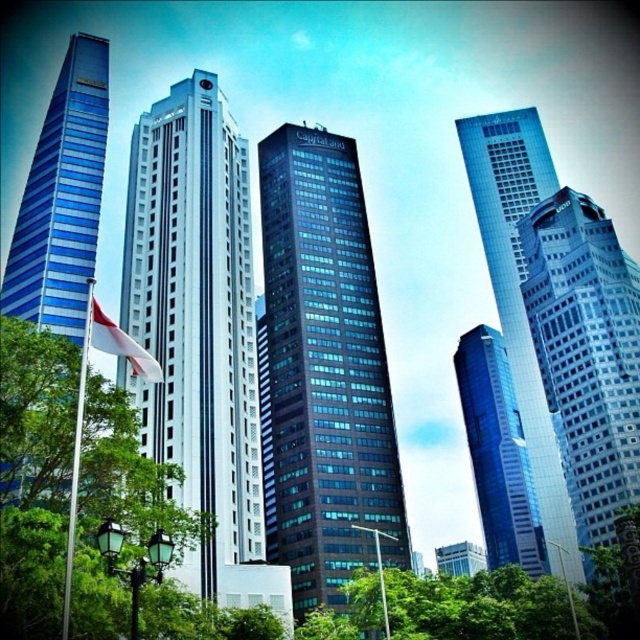
Between point (86, 380) and point (381, 586), which one is positioned in front?

Point (86, 380)

Is green leafy tree at lower left above metallic flag pole at center?

Yes.

Is point (180, 536) closer to camera compared to point (378, 552)?

Yes, point (180, 536) is in front of point (378, 552).

Where is `green leafy tree at lower left`? The image size is (640, 640). green leafy tree at lower left is located at coordinates (35, 472).

Between green leafy tree at lower left and silver metallic flag pole at left, which one appears on the right side from the viewer's perspective?

From the viewer's perspective, green leafy tree at lower left appears more on the right side.

Can you confirm if green leafy tree at lower left is taller than silver metallic flag pole at left?

Yes, green leafy tree at lower left is taller than silver metallic flag pole at left.

At what (x,y) coordinates should I click in order to perform the action: click on green leafy tree at lower left. Please return your answer as a coordinate pair (x, y). The height and width of the screenshot is (640, 640). Looking at the image, I should click on (35, 472).

How far apart are green leafy tree at lower left and white fabric flag at left?

green leafy tree at lower left and white fabric flag at left are 31.84 feet apart.

I want to click on green leafy tree at lower left, so click(x=35, y=472).